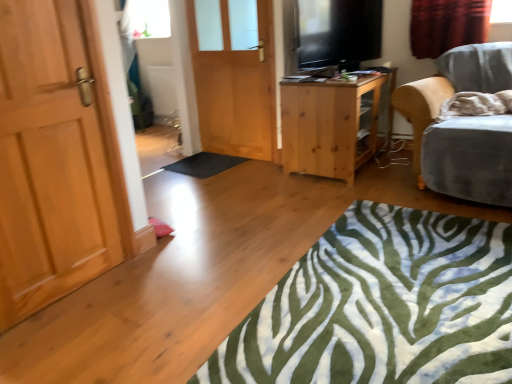
Where is `blank space to the left of green zebra-patterned rug at lower center`? blank space to the left of green zebra-patterned rug at lower center is located at coordinates (185, 280).